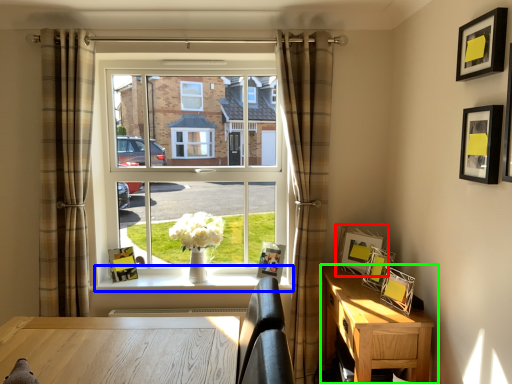
Question: Which object is the closest to the picture frame (highlighted by a red box)? Choose among these: window sill (highlighted by a blue box) or nightstand (highlighted by a green box).

Choices:
 (A) window sill
 (B) nightstand

Answer: (B)